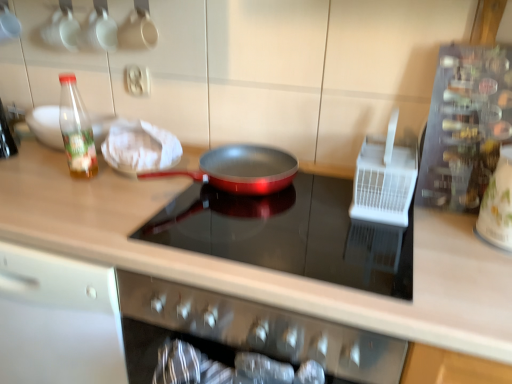
Question: From a real-world perspective, is white plastic utensil holder at right, which ranks as the third appliance in right-to-left order, positioned above or below metallic silver spice rack at right, which ranks as the 2th appliance in right-to-left order?

Choices:
 (A) above
 (B) below

Answer: (B)

Question: Considering the positions of point (377, 216) and point (485, 69), is point (377, 216) closer or farther from the camera than point (485, 69)?

Choices:
 (A) closer
 (B) farther

Answer: (B)

Question: Based on their relative distances, which object is farther from the metallic red frying pan at center?

Choices:
 (A) white cloth at upper left
 (B) metallic silver spice rack at right, which ranks as the 2th appliance in right-to-left order
 (C) white glossy jar at right, the 3th appliance positioned from the left
 (D) transparent plastic bottle at left
 (E) white plastic utensil holder at right, which is the 1th appliance from left to right

Answer: (D)

Question: Which is nearer to the white cloth at upper left?

Choices:
 (A) metallic silver spice rack at right, placed as the second appliance when sorted from left to right
 (B) metallic red frying pan at center
 (C) white plastic utensil holder at right, which ranks as the third appliance in right-to-left order
 (D) transparent plastic bottle at left
 (E) white glossy jar at right, arranged as the first appliance when viewed from the right

Answer: (D)